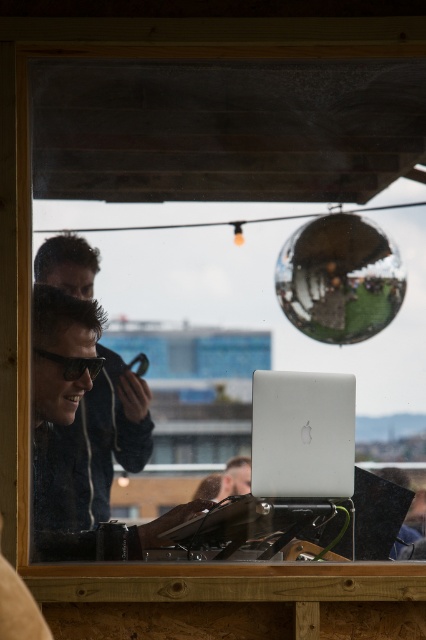
You are organizing a small tech event and need to place both the wooden table at center and the black matte goggles at center on a display stand. Since space is limited, which object should you place first to ensure both fit?

The wooden table at center is bigger than the black matte goggles at center, so you should place the wooden table at center first to ensure both fit on the display stand.

In the scene shown: You are a photographer trying to capture a clear shot of the matte black sunglasses at lower left from the camera. Given that the camera has a minimum focusing distance of 2 meters, can you take a clear photo?

The matte black sunglasses at lower left is 2.60 meters from camera, which is beyond the camera minimum focusing distance of 2 meters. So yes, you can take a clear photo.

You are a customer in a booth and want to place your black matte goggles at center on the wooden table at center. Will the goggles fit on the table without hanging off the edge?

The wooden table at center is taller than black matte goggles at center, so the goggles will fit on the table without hanging off the edge since the table is higher in height than the goggles.